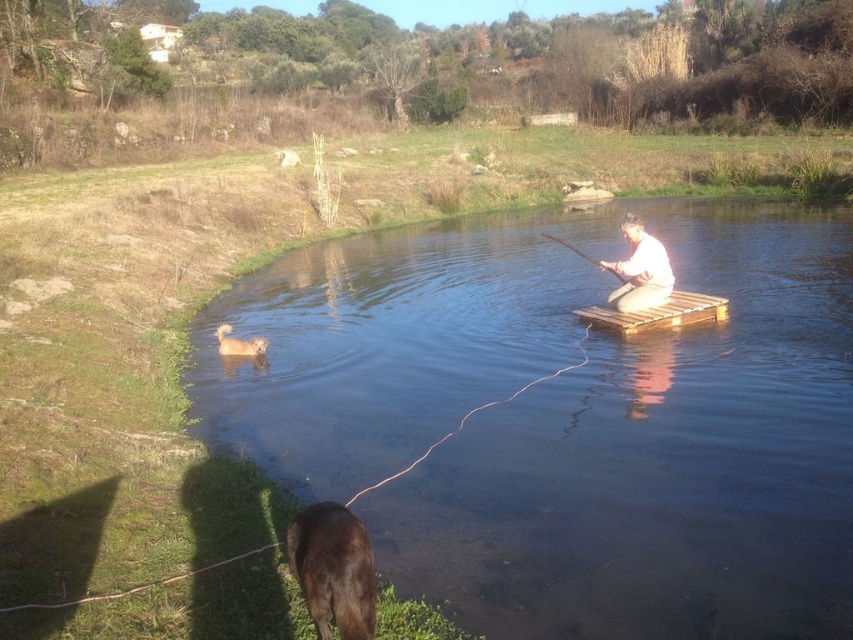
Question: Does brown furry dog at lower center have a lesser width compared to white cotton shirt at center?

Choices:
 (A) yes
 (B) no

Answer: (A)

Question: Which point is closer to the camera?

Choices:
 (A) (648, 323)
 (B) (548, 237)
 (C) (260, 353)

Answer: (A)

Question: Among these objects, which one is nearest to the camera?

Choices:
 (A) wooden stick at center
 (B) wooden pallet at center
 (C) fuzzy beige dog at lower left
 (D) clear water at center

Answer: (D)

Question: Based on their relative distances, which object is farther from the white cotton shirt at center?

Choices:
 (A) wooden pallet at center
 (B) fuzzy beige dog at lower left
 (C) clear water at center

Answer: (B)

Question: Can you confirm if brown furry dog at lower center is positioned above fuzzy beige dog at lower left?

Choices:
 (A) yes
 (B) no

Answer: (B)

Question: Does wooden pallet at center appear under wooden stick at center?

Choices:
 (A) no
 (B) yes

Answer: (B)